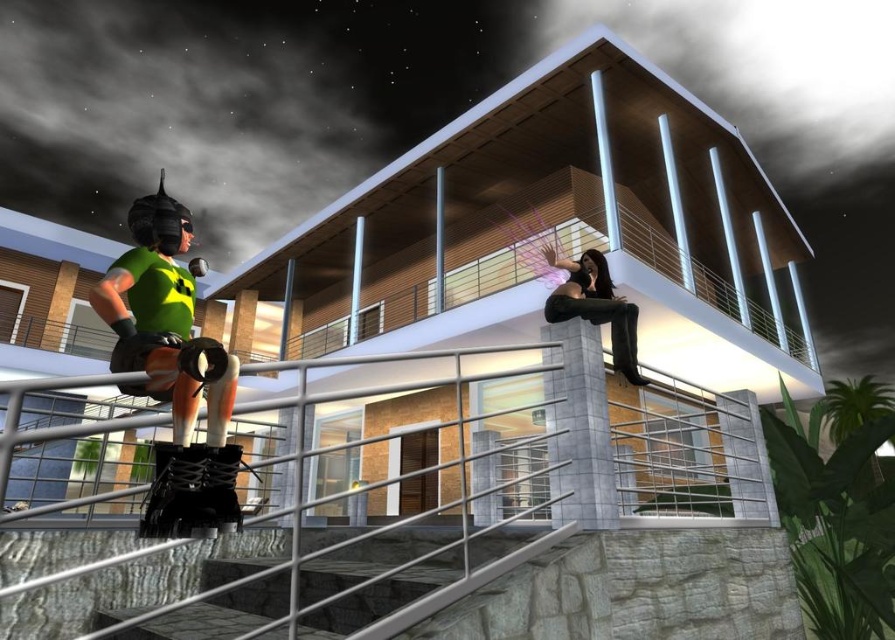
Question: Is the position of metallic silver rail at lower center more distant than that of matte green jersey at left?

Choices:
 (A) yes
 (B) no

Answer: (A)

Question: In this image, where is metallic silver rail at lower center located relative to matte black pants at upper center?

Choices:
 (A) left
 (B) right

Answer: (A)

Question: Can you confirm if matte green jersey at left is positioned below stone textured stairs at lower center?

Choices:
 (A) no
 (B) yes

Answer: (A)

Question: Which is farther from the matte black pants at upper center?

Choices:
 (A) metallic silver rail at lower center
 (B) matte green jersey at left
 (C) stone textured stairs at lower center

Answer: (B)

Question: Which of the following is the farthest from the observer?

Choices:
 (A) metallic silver rail at lower center
 (B) matte black pants at upper center
 (C) stone textured stairs at lower center

Answer: (B)

Question: Which is farther from the matte black pants at upper center?

Choices:
 (A) stone textured stairs at lower center
 (B) matte green jersey at left

Answer: (B)